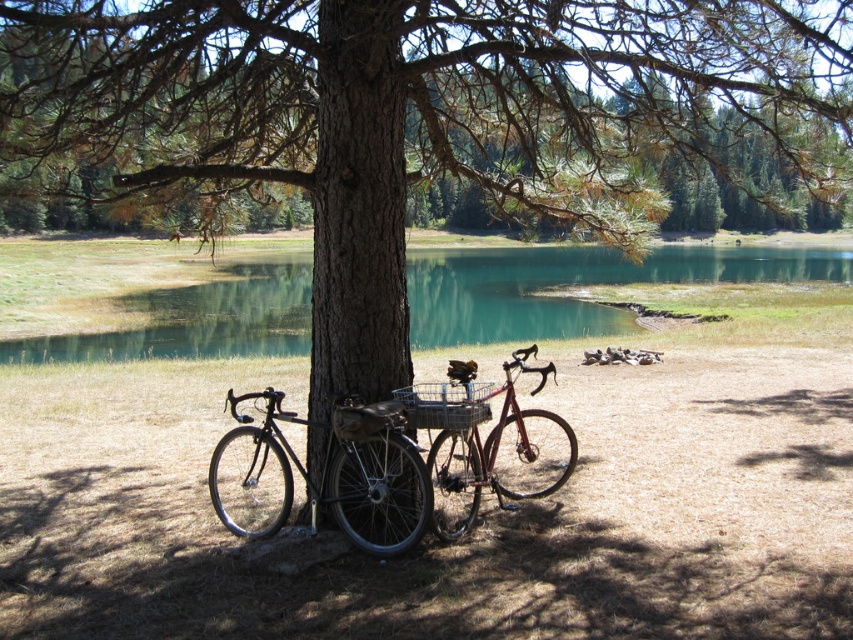
Question: Can you confirm if green water at center is positioned to the right of shiny red bicycle at center?

Choices:
 (A) no
 (B) yes

Answer: (B)

Question: Can you confirm if shiny black bicycle at center is positioned above shiny red bicycle at center?

Choices:
 (A) no
 (B) yes

Answer: (A)

Question: Is the position of green water at center less distant than that of shiny black bicycle at center?

Choices:
 (A) no
 (B) yes

Answer: (A)

Question: Which point appears closest to the camera in this image?

Choices:
 (A) (488, 451)
 (B) (219, 314)

Answer: (A)

Question: Which of the following is the farthest from the observer?

Choices:
 (A) (410, 486)
 (B) (740, 256)

Answer: (B)

Question: Which point is farther to the camera?

Choices:
 (A) shiny black bicycle at center
 (B) shiny red bicycle at center
 (C) green water at center

Answer: (C)